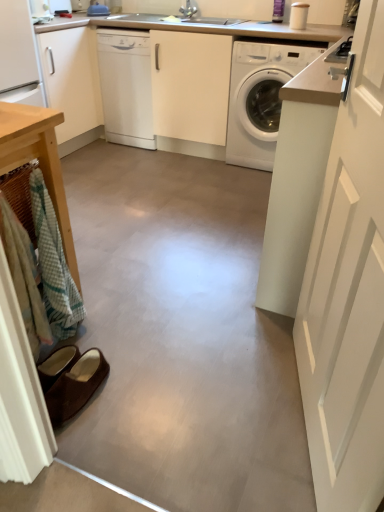
The height and width of the screenshot is (512, 384). Identify the location of free space above smooth concrete floor at center (from a real-world perspective). (178, 257).